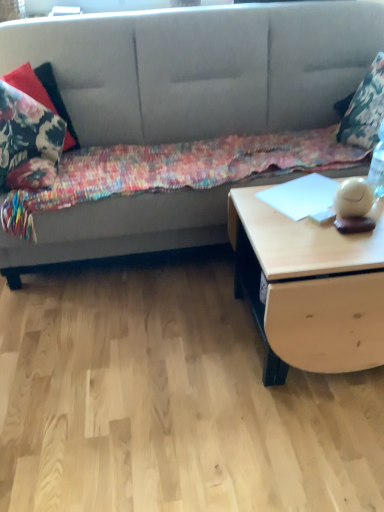
Identify the location of vacant area in front of light wood/texture table at right. click(301, 441).